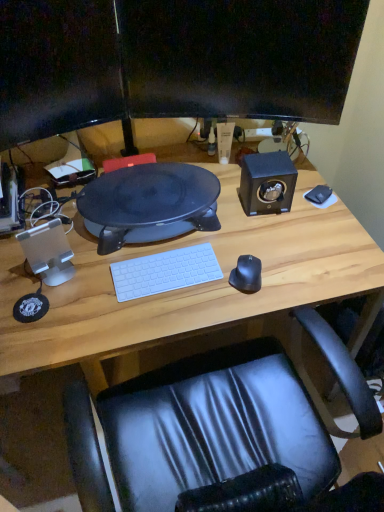
You are a GUI agent. You are given a task and a screenshot of the screen. Output one action in this format:
    pyautogui.click(x=<x>, y=<y>)
    Task: Click on the free spot in front of black matte speaker at upper right, marked as the second speaker in a front-to-back arrangement
    Image resolution: width=384 pixels, height=512 pixels.
    Given the screenshot: What is the action you would take?
    pyautogui.click(x=273, y=239)